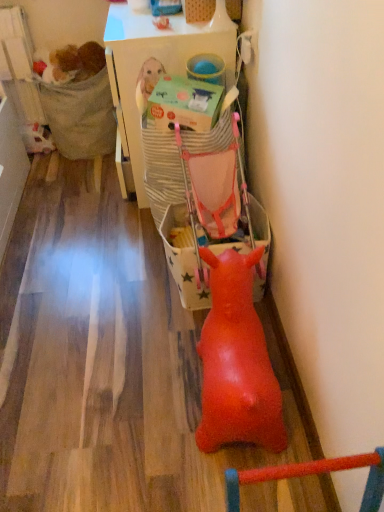
Question: From the image's perspective, would you say textured fabric chair at left is shown under rubber duck at center?

Choices:
 (A) no
 (B) yes

Answer: (A)

Question: Is textured fabric chair at left shorter than rubber duck at center?

Choices:
 (A) no
 (B) yes

Answer: (B)

Question: From a real-world perspective, is textured fabric chair at left physically above rubber duck at center?

Choices:
 (A) no
 (B) yes

Answer: (B)

Question: Considering the relative sizes of textured fabric chair at left and rubber duck at center in the image provided, is textured fabric chair at left taller than rubber duck at center?

Choices:
 (A) no
 (B) yes

Answer: (A)

Question: Can you confirm if textured fabric chair at left is wider than rubber duck at center?

Choices:
 (A) yes
 (B) no

Answer: (A)

Question: Considering the relative sizes of textured fabric chair at left and rubber duck at center in the image provided, is textured fabric chair at left bigger than rubber duck at center?

Choices:
 (A) no
 (B) yes

Answer: (A)

Question: Is matte green cardboard box at center oriented away from fuzzy brown stuffed animal at upper left?

Choices:
 (A) no
 (B) yes

Answer: (A)

Question: Is matte green cardboard box at center located outside fuzzy brown stuffed animal at upper left?

Choices:
 (A) yes
 (B) no

Answer: (A)

Question: From the image's perspective, is matte green cardboard box at center on top of fuzzy brown stuffed animal at upper left?

Choices:
 (A) yes
 (B) no

Answer: (B)

Question: Can you confirm if matte green cardboard box at center is positioned to the right of fuzzy brown stuffed animal at upper left?

Choices:
 (A) no
 (B) yes

Answer: (B)

Question: Does matte green cardboard box at center appear on the left side of fuzzy brown stuffed animal at upper left?

Choices:
 (A) no
 (B) yes

Answer: (A)

Question: Can fuzzy brown stuffed animal at upper left be found inside matte green cardboard box at center?

Choices:
 (A) no
 (B) yes

Answer: (A)

Question: Is rubber duck at center not close to fuzzy brown stuffed animal at upper left?

Choices:
 (A) yes
 (B) no

Answer: (A)